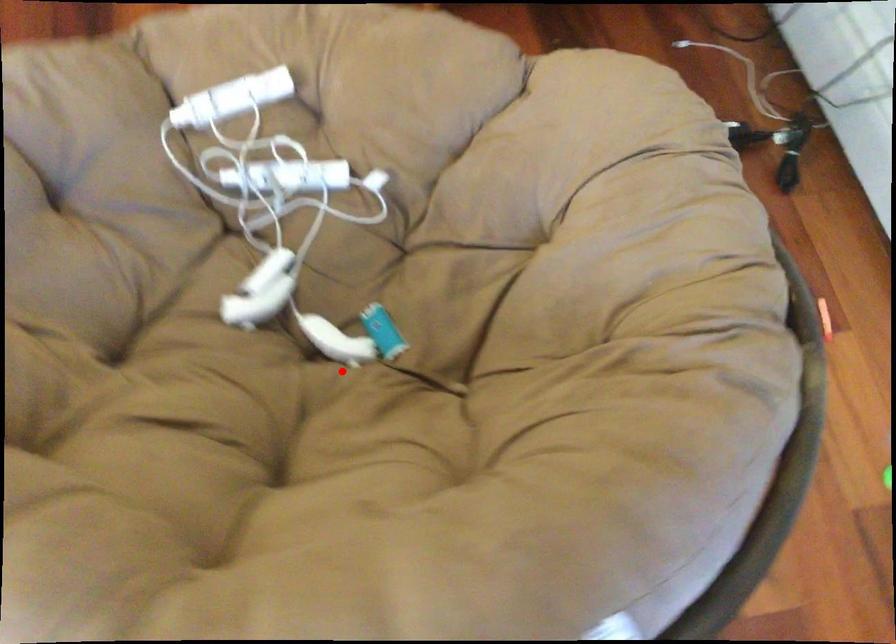
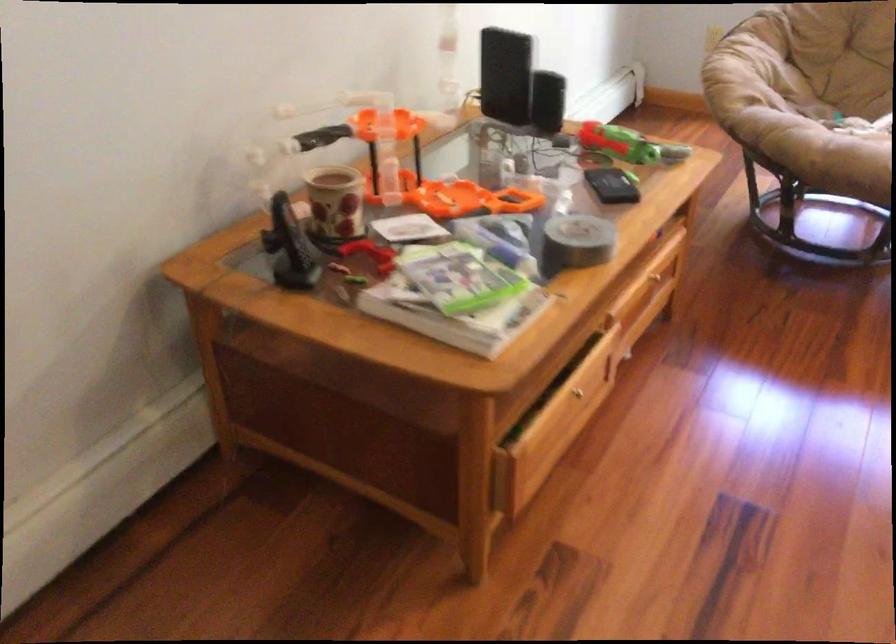
Where in the second image is the point corresponding to the highlighted location from the first image?

(842, 118)